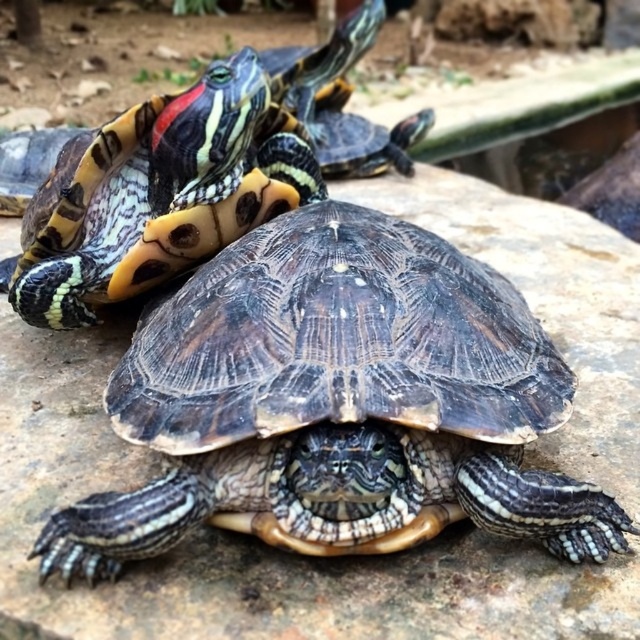
Question: Considering the real-world distances, which object is closest to the shiny black shell at center?

Choices:
 (A) shiny black turtle at upper center
 (B) shiny brown tortoise at center

Answer: (B)

Question: Is shiny brown tortoise at center bigger than shiny black shell at center?

Choices:
 (A) yes
 (B) no

Answer: (A)

Question: Is shiny brown tortoise at center above shiny black shell at center?

Choices:
 (A) yes
 (B) no

Answer: (B)

Question: Among these points, which one is nearest to the camera?

Choices:
 (A) (323, 112)
 (B) (300, 481)
 (C) (268, 148)

Answer: (B)

Question: Which object is farther from the camera taking this photo?

Choices:
 (A) shiny brown tortoise at center
 (B) shiny black turtle at upper center
 (C) shiny black shell at center

Answer: (B)

Question: Is shiny black shell at center positioned in front of shiny black turtle at upper center?

Choices:
 (A) yes
 (B) no

Answer: (A)